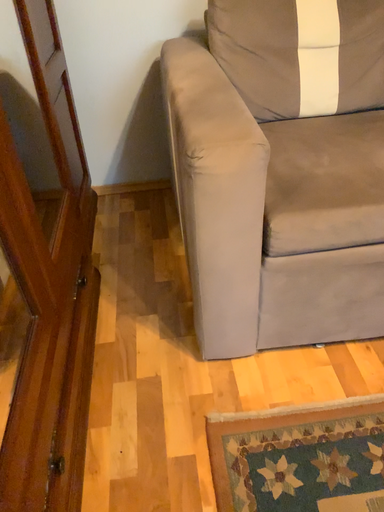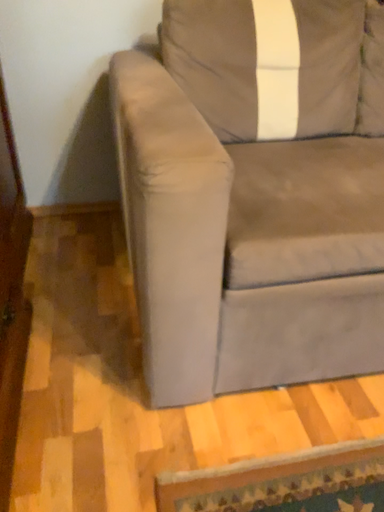
Question: How did the camera likely rotate when shooting the video?

Choices:
 (A) rotated right
 (B) rotated left

Answer: (A)